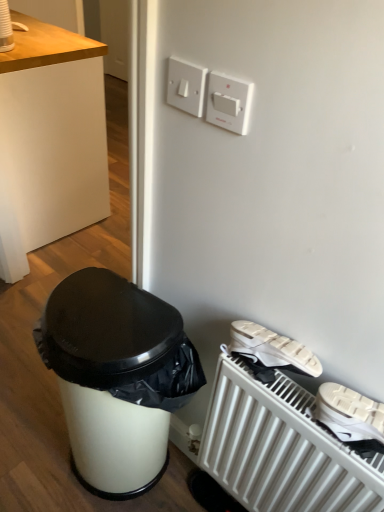
You are a GUI agent. You are given a task and a screenshot of the screen. Output one action in this format:
    pyautogui.click(x=<x>, y=<y>)
    Task: Click on the empty space that is ontop of white matte radiator at lower right
    The image size is (384, 512).
    Given the screenshot: What is the action you would take?
    pyautogui.click(x=308, y=404)